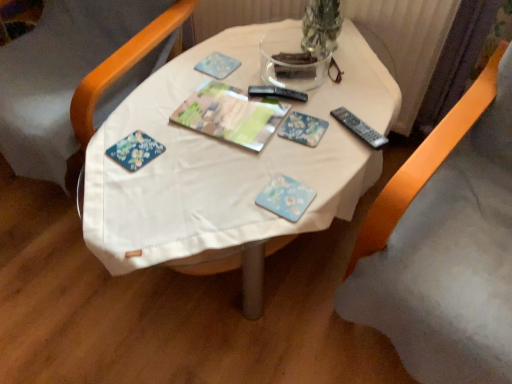
The width and height of the screenshot is (512, 384). In order to click on vacant point to the right of floral paper magazine at center in this screenshot , I will do `click(319, 117)`.